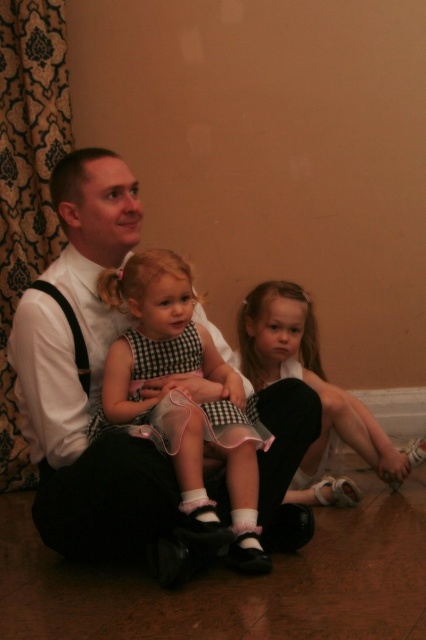
From the picture: Which is above, white shirt at center or checkered fabric dress at center?

white shirt at center is above.

Looking at this image, does white shirt at center appear on the left side of checkered fabric dress at center?

Correct, you'll find white shirt at center to the left of checkered fabric dress at center.

Between point (66, 257) and point (120, 365), which one is positioned in front?

Point (120, 365) is in front.

Locate an element on the screen. The image size is (426, 640). white shirt at center is located at coordinates (89, 378).

Can you confirm if checkered fabric dress at center is shorter than matte black dress at center?

In fact, checkered fabric dress at center may be taller than matte black dress at center.

Who is more distant from viewer, (158,312) or (268,307)?

The point (268,307) is more distant.

Find the location of a particular element. This screenshot has width=426, height=640. checkered fabric dress at center is located at coordinates (184, 400).

Who is taller, white shirt at center or matte black dress at center?

Standing taller between the two is white shirt at center.

Does white shirt at center have a lesser height compared to matte black dress at center?

No.

What do you see at coordinates (89, 378) in the screenshot?
I see `white shirt at center` at bounding box center [89, 378].

This screenshot has width=426, height=640. In order to click on white shirt at center in this screenshot , I will do `click(89, 378)`.